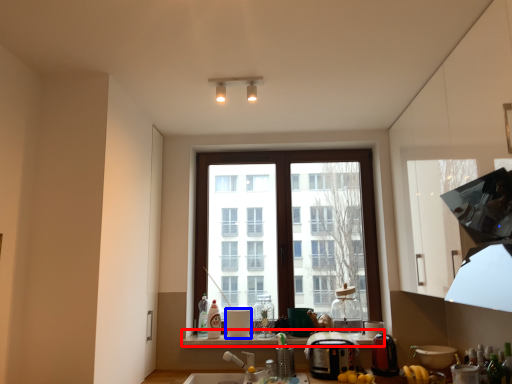
Question: Which of the following is the closest to the observer, window sill (highlighted by a red box) or appliance (highlighted by a blue box)?

Choices:
 (A) window sill
 (B) appliance

Answer: (A)